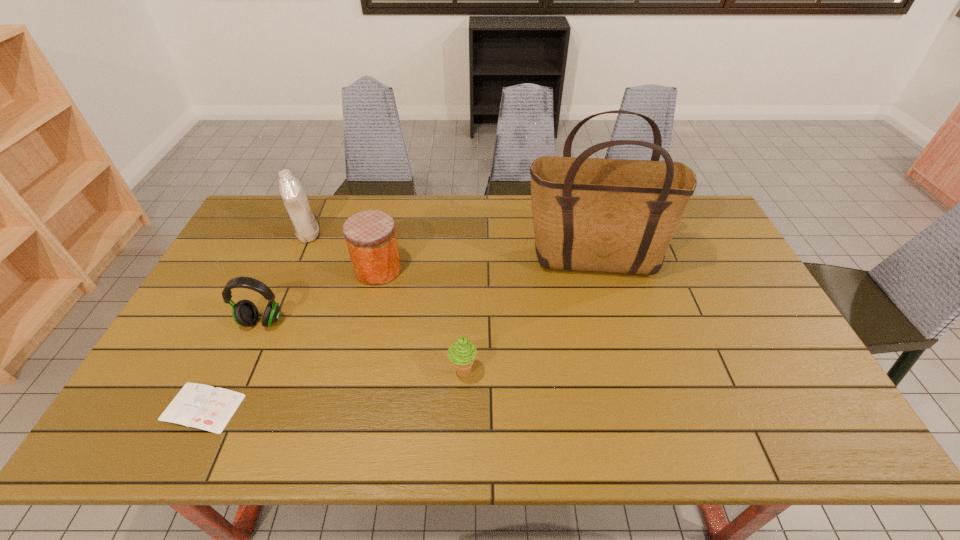
What are the coordinates of `vacant space located 0.210m on the ear cups of the headset` in the screenshot? It's located at (226, 403).

Identify the location of vacant area situated 0.150m on the front of the icecream. (461, 444).

Locate an element on the screen. The image size is (960, 540). blank space located 0.390m on the back of the diary is located at coordinates (269, 272).

Identify the location of object situated at the far edge. This screenshot has height=540, width=960. (297, 206).

The image size is (960, 540). I want to click on object at the near edge, so click(x=205, y=407).

Identify the location of headset that is positioned at the left edge. This screenshot has height=540, width=960. 245,313.

At what (x,y) coordinates should I click in order to perform the action: click on diary that is positioned at the left edge. Please return your answer as a coordinate pair (x, y). Looking at the image, I should click on (205, 407).

Where is `object located at the near left corner`? object located at the near left corner is located at coordinates (205, 407).

At what (x,y) coordinates should I click in order to perform the action: click on vacant position at the far edge of the desktop. Please return your answer as a coordinate pair (x, y). Looking at the image, I should click on click(x=471, y=200).

The height and width of the screenshot is (540, 960). In the image, there is a desktop. Identify the location of free region at the left edge. (234, 274).